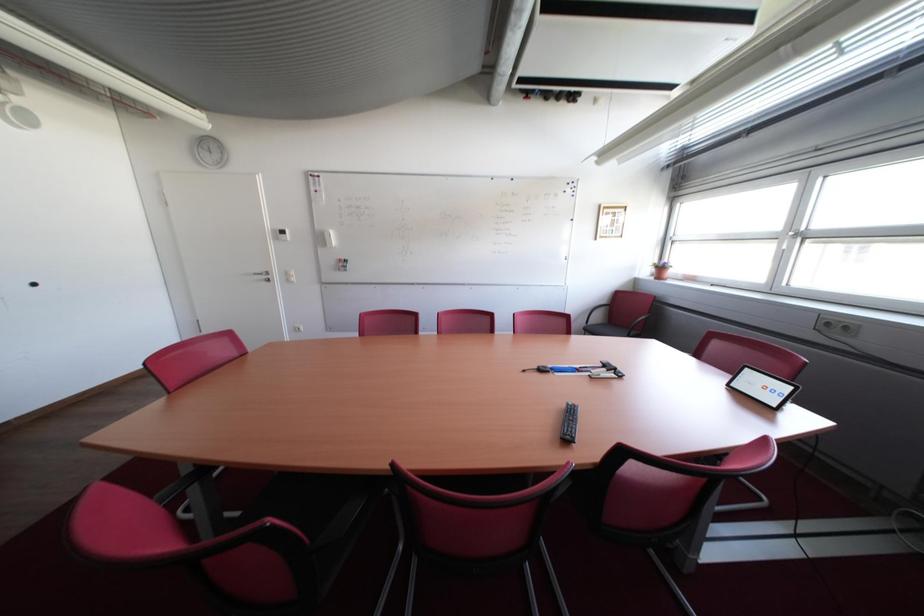
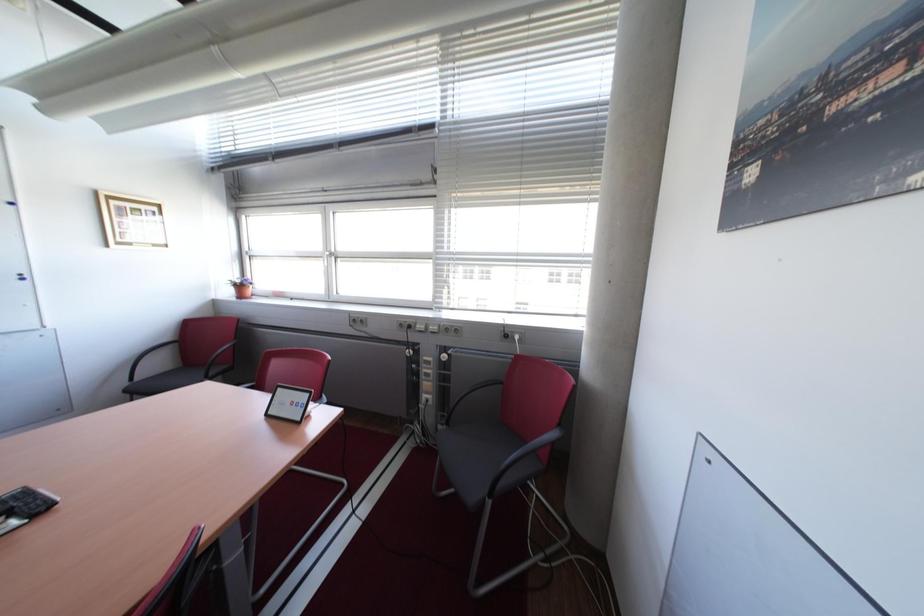
Question: The camera is either moving clockwise (left) or counter-clockwise (right) around the object. The first image is from the beginning of the video and the second image is from the end. Is the camera moving left or right when shooting the video?

Choices:
 (A) Left
 (B) Right

Answer: (A)